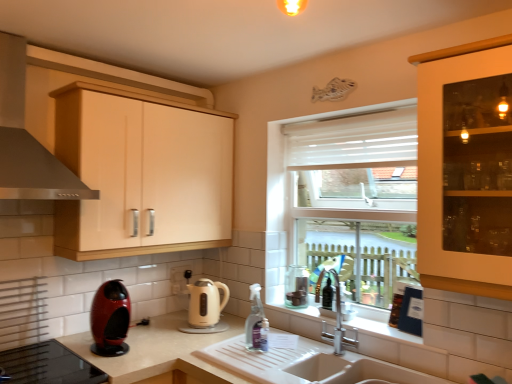
Question: Should I look upward or downward to see satin silver exhaust hood at upper left?

Choices:
 (A) up
 (B) down

Answer: (A)

Question: Can you confirm if clear plastic spray bottle at sink is smaller than beige glossy electric kettle at center?

Choices:
 (A) yes
 (B) no

Answer: (A)

Question: Is clear plastic spray bottle at sink positioned far away from beige glossy electric kettle at center?

Choices:
 (A) yes
 (B) no

Answer: (B)

Question: Is clear plastic spray bottle at sink completely or partially outside of beige glossy electric kettle at center?

Choices:
 (A) no
 (B) yes

Answer: (B)

Question: From the image's perspective, is clear plastic spray bottle at sink over beige glossy electric kettle at center?

Choices:
 (A) no
 (B) yes

Answer: (B)

Question: Is clear plastic spray bottle at sink next to beige glossy electric kettle at center and touching it?

Choices:
 (A) no
 (B) yes

Answer: (A)

Question: From a real-world perspective, is clear plastic spray bottle at sink below beige glossy electric kettle at center?

Choices:
 (A) no
 (B) yes

Answer: (A)

Question: Is beige glossy electric kettle at center not near matte wood cabinet at upper left?

Choices:
 (A) no
 (B) yes

Answer: (A)

Question: Considering the relative sizes of beige glossy electric kettle at center and matte wood cabinet at upper left in the image provided, is beige glossy electric kettle at center smaller than matte wood cabinet at upper left?

Choices:
 (A) yes
 (B) no

Answer: (A)

Question: Is beige glossy electric kettle at center looking in the opposite direction of matte wood cabinet at upper left?

Choices:
 (A) no
 (B) yes

Answer: (A)

Question: Is beige glossy electric kettle at center wider than matte wood cabinet at upper left?

Choices:
 (A) no
 (B) yes

Answer: (A)

Question: Are beige glossy electric kettle at center and matte wood cabinet at upper left beside each other?

Choices:
 (A) yes
 (B) no

Answer: (B)

Question: Is the position of beige glossy electric kettle at center more distant than that of matte wood cabinet at upper left?

Choices:
 (A) yes
 (B) no

Answer: (A)

Question: Considering the relative sizes of matte wood cabinet at upper left and satin silver exhaust hood at upper left in the image provided, is matte wood cabinet at upper left taller than satin silver exhaust hood at upper left?

Choices:
 (A) no
 (B) yes

Answer: (B)